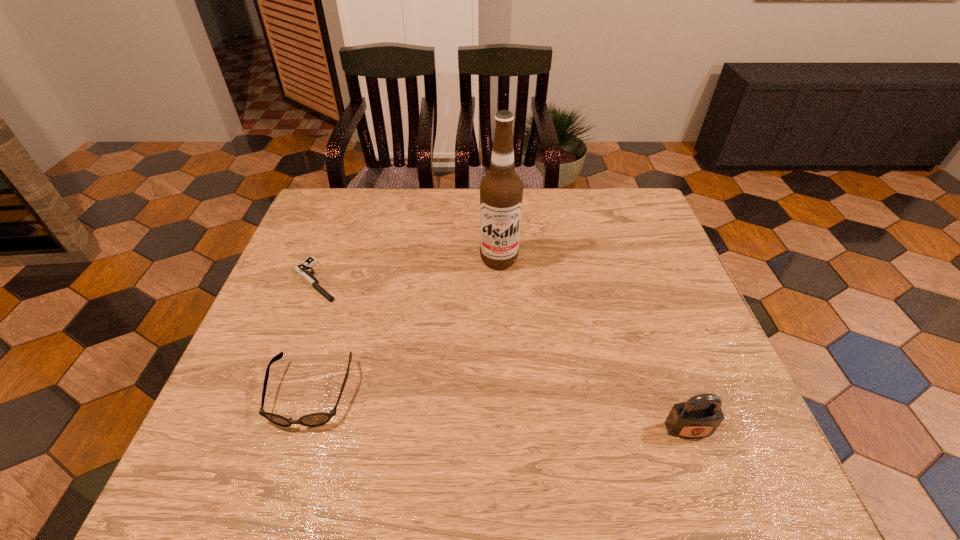
Identify the location of free space at the left edge of the desktop. (300, 282).

Locate an element on the screen. This screenshot has width=960, height=540. vacant space at the right edge is located at coordinates (670, 352).

This screenshot has width=960, height=540. I want to click on blank area at the far left corner, so click(x=362, y=195).

Locate an element on the screen. vacant space at the far right corner is located at coordinates (640, 201).

Image resolution: width=960 pixels, height=540 pixels. In the image, there is a desktop. Identify the location of vacant region at the near right corner. (674, 391).

You are a GUI agent. You are given a task and a screenshot of the screen. Output one action in this format:
    pyautogui.click(x=<x>, y=<y>)
    Task: Click on the blank region between the shortest object and the second tallest object
    
    Given the screenshot: What is the action you would take?
    pyautogui.click(x=502, y=355)

Where is `free space that is in between the sunglasses and the padlock`? The height and width of the screenshot is (540, 960). free space that is in between the sunglasses and the padlock is located at coordinates (499, 411).

Where is `vacant area between the rightmost object and the sunglasses`? vacant area between the rightmost object and the sunglasses is located at coordinates (499, 411).

Where is `vacant point located between the rightmost object and the pistol`? The image size is (960, 540). vacant point located between the rightmost object and the pistol is located at coordinates (502, 355).

Find the location of `vacant area between the third shortest object and the pistol`. vacant area between the third shortest object and the pistol is located at coordinates (502, 355).